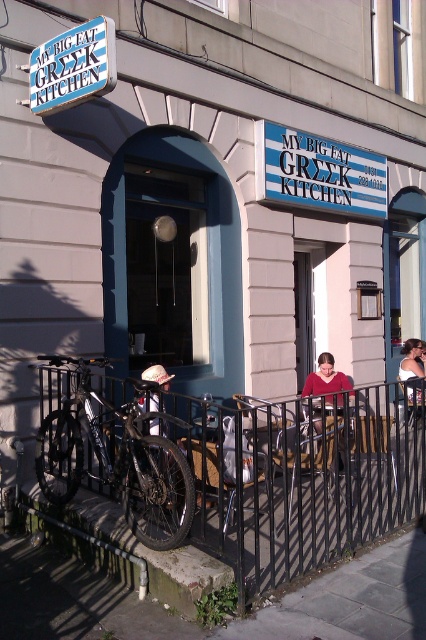
Question: Which of the following is the closest to the observer?

Choices:
 (A) concrete pavement at lower center
 (B) white matte baseball cap at center
 (C) black metal fence at lower center
 (D) white fabric top at center

Answer: (A)

Question: Can you confirm if concrete pavement at lower center is thinner than silver metallic bicycle at lower left?

Choices:
 (A) no
 (B) yes

Answer: (A)

Question: Which point is closer to the camera taking this photo?

Choices:
 (A) (334, 413)
 (B) (253, 628)
 (C) (146, 529)

Answer: (B)

Question: Is concrete pavement at lower center in front of white matte baseball cap at center?

Choices:
 (A) yes
 (B) no

Answer: (A)

Question: Does black metal fence at lower center appear on the left side of concrete pavement at lower center?

Choices:
 (A) yes
 (B) no

Answer: (B)

Question: Based on their relative distances, which object is farther from the matte red sweater at center?

Choices:
 (A) silver metallic bicycle at lower left
 (B) concrete pavement at lower center
 (C) white fabric top at center
 (D) white matte baseball cap at center

Answer: (B)